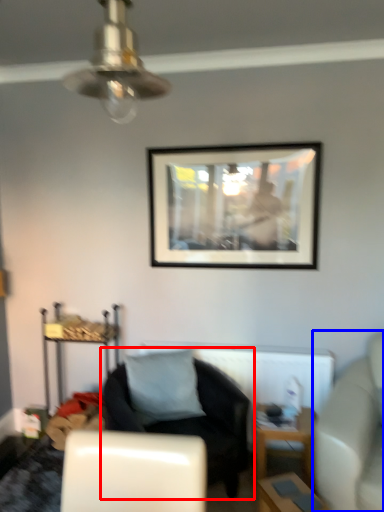
Question: Which point is further to the camera, chair (highlighted by a red box) or studio couch (highlighted by a blue box)?

Choices:
 (A) chair
 (B) studio couch

Answer: (A)